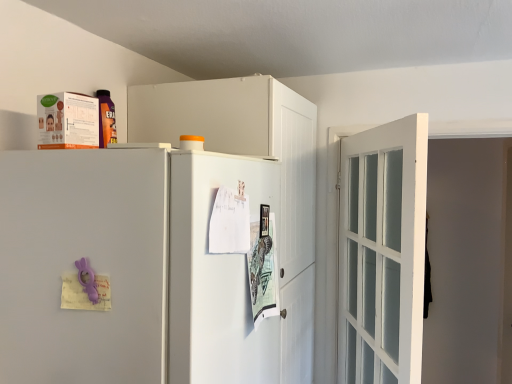
The width and height of the screenshot is (512, 384). What do you see at coordinates (216, 276) in the screenshot?
I see `white glossy screen door at center` at bounding box center [216, 276].

Where is `white glossy screen door at center`? The height and width of the screenshot is (384, 512). white glossy screen door at center is located at coordinates (216, 276).

Are white matte cabinet at upper center and white glass door at right far apart?

No, white matte cabinet at upper center is in close proximity to white glass door at right.

Find the location of a particular element. The height and width of the screenshot is (384, 512). door that is under the white matte cabinet at upper center (from a real-world perspective) is located at coordinates (381, 253).

Would you say white matte cabinet at upper center is to the left or to the right of white glass door at right in the picture?

white matte cabinet at upper center is positioned on white glass door at right's left side.

Could you tell me if white matte cabinet at upper center is turned towards white glass door at right?

Yes, white matte cabinet at upper center faces towards white glass door at right.

Can white glossy screen door at center be found inside white matte refrigerator at center?

Yes, white matte refrigerator at center contains white glossy screen door at center.

Are white matte refrigerator at center and white glossy screen door at center beside each other?

white matte refrigerator at center and white glossy screen door at center are clearly separated.

How many degrees apart are the facing directions of white matte refrigerator at center and white glossy screen door at center?

There is a 0.00472-degree angle between the facing directions of white matte refrigerator at center and white glossy screen door at center.

From a real-world perspective, who is located lower, white matte refrigerator at center or white glossy screen door at center?

From a 3D spatial view, white matte refrigerator at center is below.

What's the angular difference between white glass door at right and white matte cabinet at upper center's facing directions?

23.8 degrees.

Which object is positioned more to the left, white glass door at right or white matte cabinet at upper center?

white matte cabinet at upper center is more to the left.

Which of these two, white glass door at right or white matte cabinet at upper center, is thinner?

Thinner between the two is white glass door at right.

From the image's perspective, which one is positioned lower, white glass door at right or white matte cabinet at upper center?

white glass door at right, from the image's perspective.

Is white glossy screen door at center facing towards white matte cabinet at upper center?

No.

How much distance is there between white glossy screen door at center and white matte cabinet at upper center?

They are 19.93 inches apart.

Who is more distant, white glossy screen door at center or white matte cabinet at upper center?

white matte cabinet at upper center is further away from the camera.

Considering the sizes of white matte refrigerator at center and white matte cabinet at upper center in the image, is white matte refrigerator at center wider or thinner than white matte cabinet at upper center?

white matte refrigerator at center is wider than white matte cabinet at upper center.

Which object is more forward, white matte refrigerator at center or white matte cabinet at upper center?

Positioned in front is white matte refrigerator at center.

What's the angular difference between white matte refrigerator at center and white matte cabinet at upper center's facing directions?

There is a 0.000315-degree angle between the facing directions of white matte refrigerator at center and white matte cabinet at upper center.

Can you confirm if white matte refrigerator at center is bigger than white matte cabinet at upper center?

No.

From the image's perspective, relative to white glossy screen door at center, is white matte cabinet at upper center above or below?

Clearly, from the image's perspective, white matte cabinet at upper center is below white glossy screen door at center.

Could you tell me if white matte cabinet at upper center is turned towards white glossy screen door at center?

No, white matte cabinet at upper center does not turn towards white glossy screen door at center.

Considering the positions of points (244, 113) and (180, 154), is point (244, 113) farther from camera compared to point (180, 154)?

Yes, point (244, 113) is farther from viewer.

Is white matte cabinet at upper center not inside white glossy screen door at center?

Yes, white matte cabinet at upper center is located beyond the bounds of white glossy screen door at center.

Does white glass door at right have a greater width compared to white matte refrigerator at center?

Incorrect, the width of white glass door at right does not surpass that of white matte refrigerator at center.

From the image's perspective, who appears lower, white glass door at right or white matte refrigerator at center?

white glass door at right, from the image's perspective.

Considering the positions of objects white glass door at right and white matte refrigerator at center in the image provided, who is in front, white glass door at right or white matte refrigerator at center?

white matte refrigerator at center is in front.

Which is more to the right, white glass door at right or white matte refrigerator at center?

From the viewer's perspective, white glass door at right appears more on the right side.

Image resolution: width=512 pixels, height=384 pixels. Find the location of `door below the white matte cabinet at upper center (from the image's perspective)`. door below the white matte cabinet at upper center (from the image's perspective) is located at coordinates (381, 253).

This screenshot has width=512, height=384. In order to click on refrigerator in front of the white glossy screen door at center in this screenshot , I will do click(128, 268).

Considering their positions, is white matte cabinet at upper center positioned closer to white glass door at right than white matte refrigerator at center?

white matte cabinet at upper center is closer to white glass door at right.

Which object lies further to the anchor point white glossy screen door at center, white matte cabinet at upper center or white matte refrigerator at center?

white matte cabinet at upper center lies further to white glossy screen door at center than the other object.

Based on the photo, based on their spatial positions, is white glass door at right or white matte cabinet at upper center closer to white glossy screen door at center?

white matte cabinet at upper center is positioned closer to the anchor white glossy screen door at center.

Estimate the real-world distances between objects in this image. Which object is further from white matte refrigerator at center, white matte cabinet at upper center or white glass door at right?

Based on the image, white glass door at right appears to be further to white matte refrigerator at center.

From the image, which object appears to be farther from white matte refrigerator at center, white glossy screen door at center or white matte cabinet at upper center?

white matte cabinet at upper center is further to white matte refrigerator at center.

In the scene shown: From the image, which object appears to be nearer to white glossy screen door at center, white matte cabinet at upper center or white glass door at right?

The object closer to white glossy screen door at center is white matte cabinet at upper center.

Looking at the image, which one is located further to white matte cabinet at upper center, white glossy screen door at center or white matte refrigerator at center?

white matte refrigerator at center.

Which object lies further to the anchor point white matte cabinet at upper center, white glass door at right or white matte refrigerator at center?

white matte refrigerator at center is further to white matte cabinet at upper center.

Identify the location of screen door located between white matte refrigerator at center and white matte cabinet at upper center in the depth direction. This screenshot has height=384, width=512. (216, 276).

Locate an element on the screen. The height and width of the screenshot is (384, 512). cabinetry between white matte refrigerator at center and white glass door at right is located at coordinates (244, 140).

Identify the location of screen door between white matte refrigerator at center and white glass door at right in the horizontal direction. (216, 276).

You are a GUI agent. You are given a task and a screenshot of the screen. Output one action in this format:
    pyautogui.click(x=<x>, y=<y>)
    Task: Click on the screen door situated between white matte cabinet at upper center and white glass door at right from left to right
    The height and width of the screenshot is (384, 512).
    Given the screenshot: What is the action you would take?
    pyautogui.click(x=216, y=276)